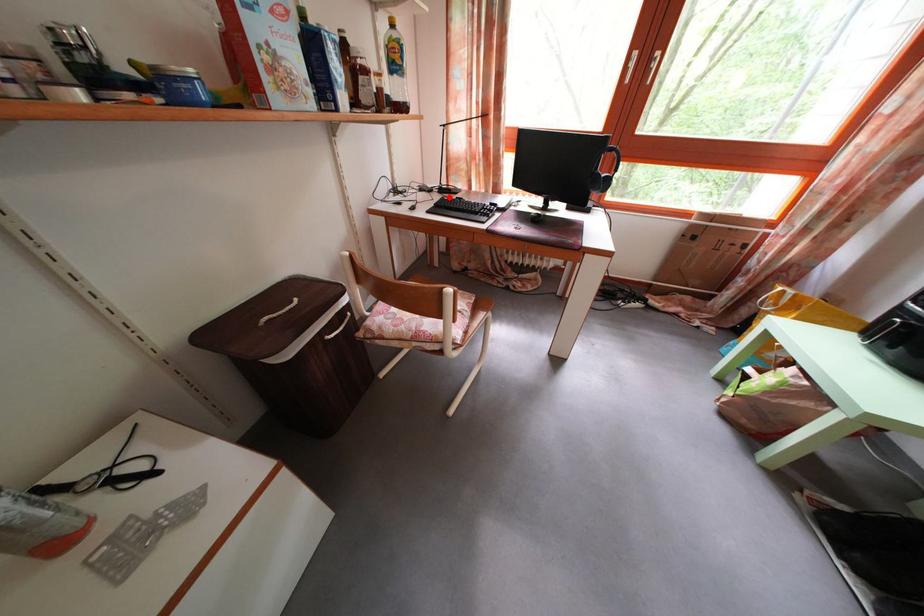
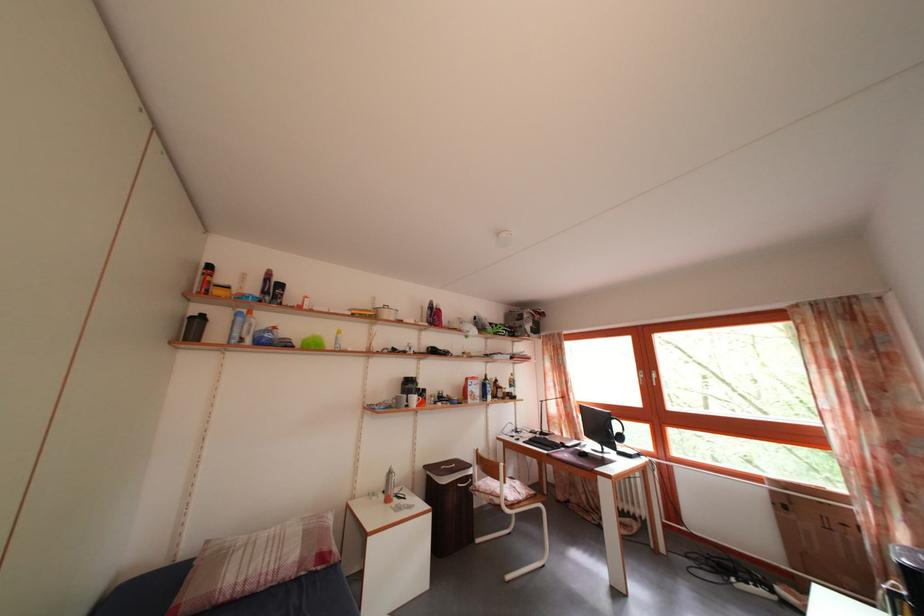
Find the pixel in the second image that matches the highlighted location in the first image.

(550, 440)